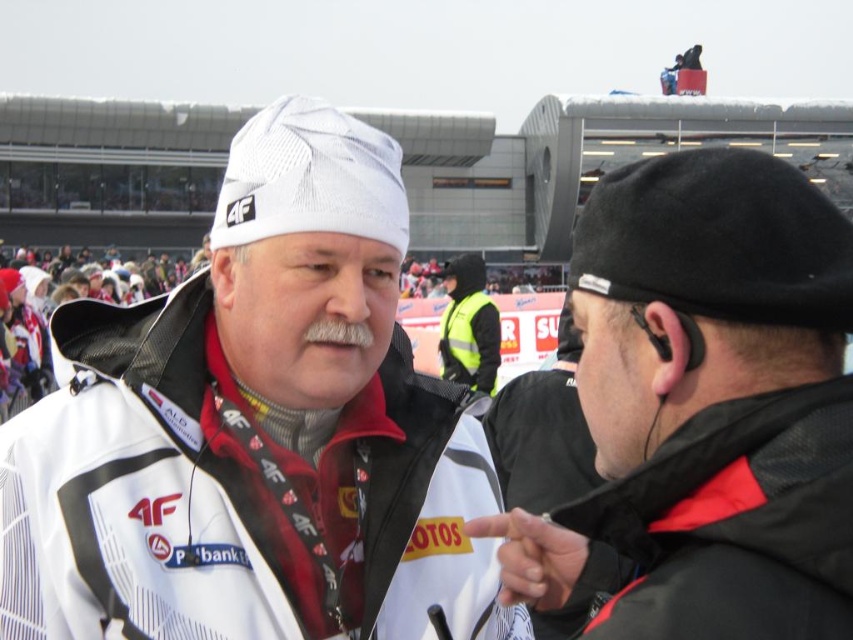
Is black matte jacket at right to the left of high-visibility yellow vest at center from the viewer's perspective?

In fact, black matte jacket at right is to the right of high-visibility yellow vest at center.

Is point (791, 372) positioned in front of point (498, 353)?

Yes, it is in front of point (498, 353).

Does point (668, 620) come in front of point (463, 337)?

Yes, it is in front of point (463, 337).

You are a GUI agent. You are given a task and a screenshot of the screen. Output one action in this format:
    pyautogui.click(x=<x>, y=<y>)
    Task: Click on the black matte jacket at right
    
    Given the screenshot: What is the action you would take?
    pyautogui.click(x=706, y=406)

Which is behind, point (479, 440) or point (521, 376)?

The point (521, 376) is behind.

This screenshot has height=640, width=853. Identify the location of white mesh cap at upper center. pos(254,432).

Can you confirm if white mesh cap at upper center is positioned to the left of black matte jacket at right?

Yes, white mesh cap at upper center is to the left of black matte jacket at right.

Locate an element on the screen. Image resolution: width=853 pixels, height=640 pixels. white mesh cap at upper center is located at coordinates (254, 432).